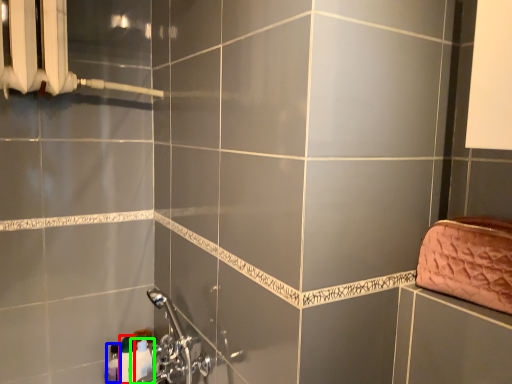
Question: Which is nearer to the toiletry (highlighted by a red box)? toiletry (highlighted by a blue box) or toiletry (highlighted by a green box).

Choices:
 (A) toiletry
 (B) toiletry

Answer: (A)